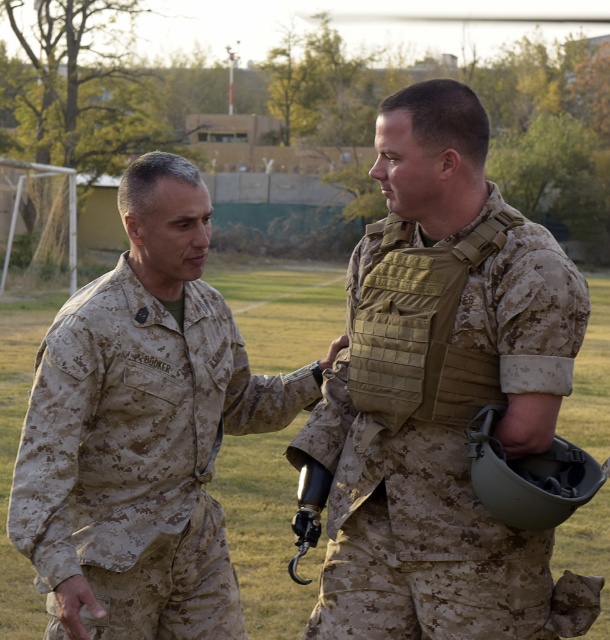
Question: Can you confirm if camouflage fabric vest at center is positioned below camouflage uniform at left?

Choices:
 (A) yes
 (B) no

Answer: (B)

Question: Does camouflage fabric vest at center have a smaller size compared to camouflage uniform at left?

Choices:
 (A) yes
 (B) no

Answer: (A)

Question: Which object appears farthest from the camera in this image?

Choices:
 (A) camouflage fabric vest at center
 (B) camouflage uniform at left

Answer: (A)

Question: Which point appears farthest from the camera in this image?

Choices:
 (A) (381, 417)
 (B) (273, 394)

Answer: (B)

Question: Which point is closer to the camera?

Choices:
 (A) click(362, 604)
 (B) click(138, 531)

Answer: (A)

Question: Is camouflage fabric vest at center below camouflage uniform at left?

Choices:
 (A) yes
 (B) no

Answer: (B)